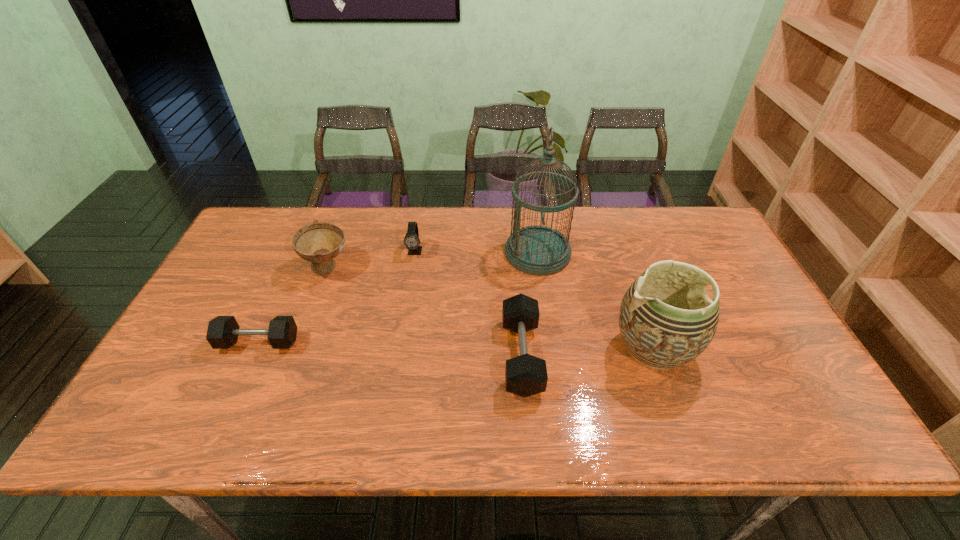
Where is `vacant point located on the front-facing side of the birdcage`? vacant point located on the front-facing side of the birdcage is located at coordinates (409, 253).

At what (x,y) coordinates should I click in order to perform the action: click on vacant space located on the front-facing side of the birdcage. Please return your answer as a coordinate pair (x, y). Looking at the image, I should click on (413, 253).

I want to click on vacant position located 0.050m on the front-facing side of the birdcage, so click(x=489, y=253).

Where is `vacant space located on the front of the third tallest object`? The height and width of the screenshot is (540, 960). vacant space located on the front of the third tallest object is located at coordinates (293, 362).

Where is `free space located on the face of the fourth object from right to left`? free space located on the face of the fourth object from right to left is located at coordinates (401, 340).

At what (x,y) coordinates should I click in order to perform the action: click on vacant space located on the left of the rightmost object. Please return your answer as a coordinate pair (x, y). Image resolution: width=960 pixels, height=540 pixels. Looking at the image, I should click on (497, 349).

The image size is (960, 540). I want to click on birdcage at the far edge, so click(537, 250).

I want to click on watch positioned at the far edge, so click(412, 242).

Locate an element on the screen. The width and height of the screenshot is (960, 540). dumbbell that is at the near edge is located at coordinates [x=525, y=375].

Where is `pottery positioned at the near edge`? pottery positioned at the near edge is located at coordinates (666, 320).